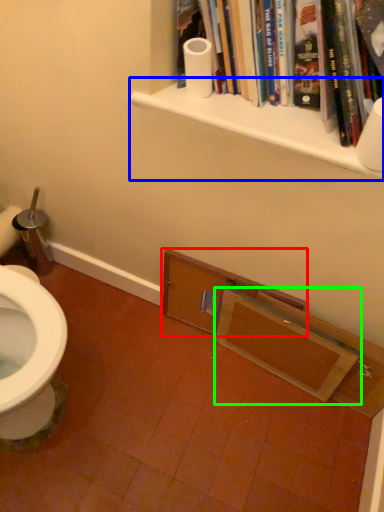
Question: Considering the real-world distances, which object is closest to shelf (highlighted by a red box)? shelf (highlighted by a blue box) or medicine cabinet (highlighted by a green box).

Choices:
 (A) shelf
 (B) medicine cabinet

Answer: (B)